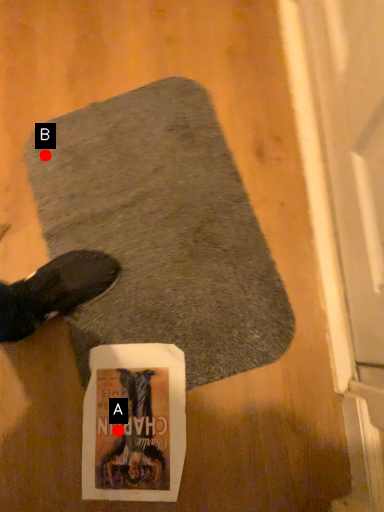
Question: Two points are circled on the image, labeled by A and B beside each circle. Which point is closer to the camera?

Choices:
 (A) A is closer
 (B) B is closer

Answer: (A)